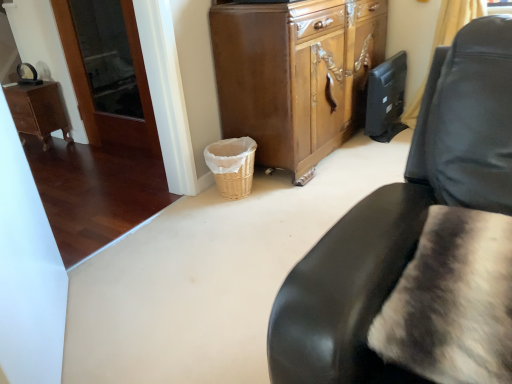
What is the approximate width of woven wicker basket at lower center?

woven wicker basket at lower center is 30.83 centimeters wide.

Where is `fuzzy fur pillow at lower right`? fuzzy fur pillow at lower right is located at coordinates (452, 301).

From the image's perspective, is fuzzy fur pillow at lower right located above wooden cabinet at center?

No, from the image's perspective, fuzzy fur pillow at lower right is not over wooden cabinet at center.

Which of these two, fuzzy fur pillow at lower right or wooden cabinet at center, is wider?

wooden cabinet at center is wider.

Could you tell me if fuzzy fur pillow at lower right is facing wooden cabinet at center?

No, fuzzy fur pillow at lower right is not aimed at wooden cabinet at center.

Which is more to the left, wooden desk at left or woven wicker basket at lower center?

Positioned to the left is wooden desk at left.

Looking at their sizes, would you say wooden desk at left is wider or thinner than woven wicker basket at lower center?

Clearly, wooden desk at left has less width compared to woven wicker basket at lower center.

From a real-world perspective, is wooden desk at left located beneath woven wicker basket at lower center?

No, from a real-world perspective, wooden desk at left is not beneath woven wicker basket at lower center.

Considering the relative positions of wooden desk at left and woven wicker basket at lower center in the image provided, is wooden desk at left behind woven wicker basket at lower center?

Yes, wooden desk at left is further from the viewer.

From the image's perspective, would you say yellow fabric curtain at upper right is positioned over fuzzy fur pillow at lower right?

Yes, from the image's perspective, yellow fabric curtain at upper right is over fuzzy fur pillow at lower right.

From a real-world perspective, is yellow fabric curtain at upper right above or below fuzzy fur pillow at lower right?

yellow fabric curtain at upper right is below fuzzy fur pillow at lower right.

Can you confirm if yellow fabric curtain at upper right is taller than fuzzy fur pillow at lower right?

Yes, yellow fabric curtain at upper right is taller than fuzzy fur pillow at lower right.

From the picture: Does yellow fabric curtain at upper right turn towards fuzzy fur pillow at lower right?

Yes.

Which object is closer to the camera taking this photo, wooden desk at left or yellow fabric curtain at upper right?

Positioned in front is yellow fabric curtain at upper right.

Is wooden desk at left turned away from yellow fabric curtain at upper right?

wooden desk at left does not have its back to yellow fabric curtain at upper right.

Which of these two, wooden cabinet at center or yellow fabric curtain at upper right, stands taller?

Standing taller between the two is wooden cabinet at center.

Is wooden cabinet at center situated inside yellow fabric curtain at upper right or outside?

wooden cabinet at center is not inside yellow fabric curtain at upper right, it's outside.

Can you confirm if wooden cabinet at center is positioned to the left of yellow fabric curtain at upper right?

Yes, wooden cabinet at center is to the left of yellow fabric curtain at upper right.

Would you say woven wicker basket at lower center is inside or outside wooden cabinet at center?

woven wicker basket at lower center lies outside wooden cabinet at center.

How different are the orientations of woven wicker basket at lower center and wooden cabinet at center in degrees?

The angular difference between woven wicker basket at lower center and wooden cabinet at center is 88.5 degrees.

Considering the sizes of woven wicker basket at lower center and wooden cabinet at center in the image, is woven wicker basket at lower center taller or shorter than wooden cabinet at center?

In the image, woven wicker basket at lower center appears to be shorter than wooden cabinet at center.

Is woven wicker basket at lower center in front of or behind wooden cabinet at center in the image?

woven wicker basket at lower center is behind wooden cabinet at center.

Considering the relative positions of woven wicker basket at lower center and wooden desk at left in the image provided, is woven wicker basket at lower center in front of wooden desk at left?

That is True.

From the image's perspective, is woven wicker basket at lower center located above wooden desk at left?

No, from the image's perspective, woven wicker basket at lower center is not on top of wooden desk at left.

Which object is wider, woven wicker basket at lower center or wooden desk at left?

With larger width is woven wicker basket at lower center.

Is wooden desk at left completely or partially inside woven wicker basket at lower center?

Definitely not — wooden desk at left is not inside woven wicker basket at lower center.

At what (x,y) coordinates should I click in order to perform the action: click on pillow located in front of the wooden cabinet at center. Please return your answer as a coordinate pair (x, y). Looking at the image, I should click on (452, 301).

You are a GUI agent. You are given a task and a screenshot of the screen. Output one action in this format:
    pyautogui.click(x=<x>, y=<y>)
    Task: Click on the desk that is behind the woven wicker basket at lower center
    The height and width of the screenshot is (384, 512).
    Given the screenshot: What is the action you would take?
    pyautogui.click(x=37, y=111)

Based on their spatial positions, is wooden cabinet at center or yellow fabric curtain at upper right further from woven wicker basket at lower center?

yellow fabric curtain at upper right is positioned further to the anchor woven wicker basket at lower center.

Estimate the real-world distances between objects in this image. Which object is further from woven wicker basket at lower center, fuzzy fur pillow at lower right or wooden cabinet at center?

Based on the image, fuzzy fur pillow at lower right appears to be further to woven wicker basket at lower center.

Estimate the real-world distances between objects in this image. Which object is closer to wooden cabinet at center, woven wicker basket at lower center or wooden desk at left?

woven wicker basket at lower center.

Based on their spatial positions, is fuzzy fur pillow at lower right or wooden desk at left further from wooden cabinet at center?

The object further to wooden cabinet at center is wooden desk at left.

From the image, which object appears to be farther from fuzzy fur pillow at lower right, wooden cabinet at center or woven wicker basket at lower center?

Among the two, wooden cabinet at center is located further to fuzzy fur pillow at lower right.

From the image, which object appears to be farther from woven wicker basket at lower center, fuzzy fur pillow at lower right or yellow fabric curtain at upper right?

The object further to woven wicker basket at lower center is yellow fabric curtain at upper right.

Based on their spatial positions, is yellow fabric curtain at upper right or wooden desk at left closer to fuzzy fur pillow at lower right?

The object closer to fuzzy fur pillow at lower right is yellow fabric curtain at upper right.

Consider the image. Considering their positions, is wooden desk at left positioned closer to yellow fabric curtain at upper right than wooden cabinet at center?

Among the two, wooden cabinet at center is located nearer to yellow fabric curtain at upper right.

Where is `cabinetry located between wooden desk at left and fuzzy fur pillow at lower right in the left-right direction`? The width and height of the screenshot is (512, 384). cabinetry located between wooden desk at left and fuzzy fur pillow at lower right in the left-right direction is located at coordinates coord(295,74).

At what (x,y) coordinates should I click in order to perform the action: click on basket between wooden desk at left and wooden cabinet at center. Please return your answer as a coordinate pair (x, y). Looking at the image, I should click on (232, 165).

Where is `cabinetry situated between wooden desk at left and yellow fabric curtain at upper right from left to right`? The width and height of the screenshot is (512, 384). cabinetry situated between wooden desk at left and yellow fabric curtain at upper right from left to right is located at coordinates (295, 74).

I want to click on cabinetry positioned between fuzzy fur pillow at lower right and yellow fabric curtain at upper right from near to far, so point(295,74).